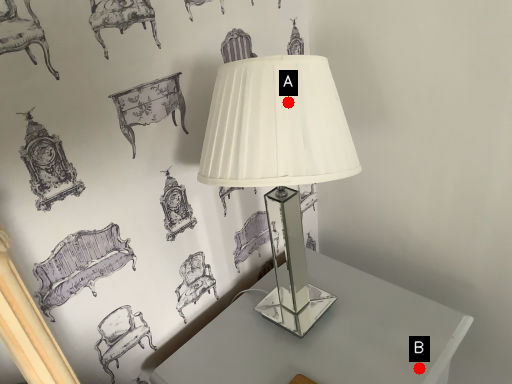
Question: Two points are circled on the image, labeled by A and B beside each circle. Which of the following is the farthest from the observer?

Choices:
 (A) A is further
 (B) B is further

Answer: (B)